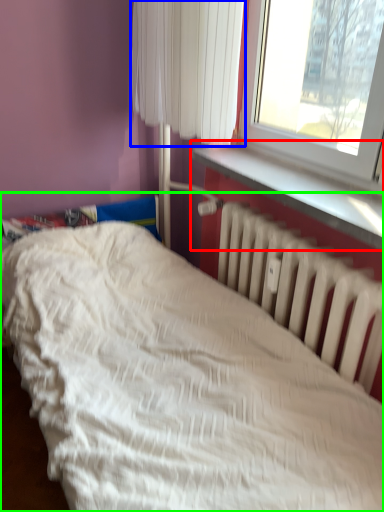
Question: Which object is positioned farthest from window sill (highlighted by a red box)? Select from curtain (highlighted by a blue box) and bed (highlighted by a green box).

Choices:
 (A) curtain
 (B) bed

Answer: (B)